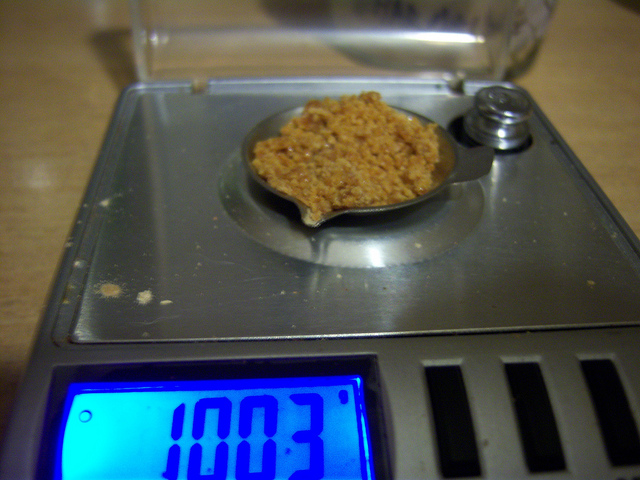
This screenshot has height=480, width=640. I want to click on wooden tabletop, so click(57, 138).